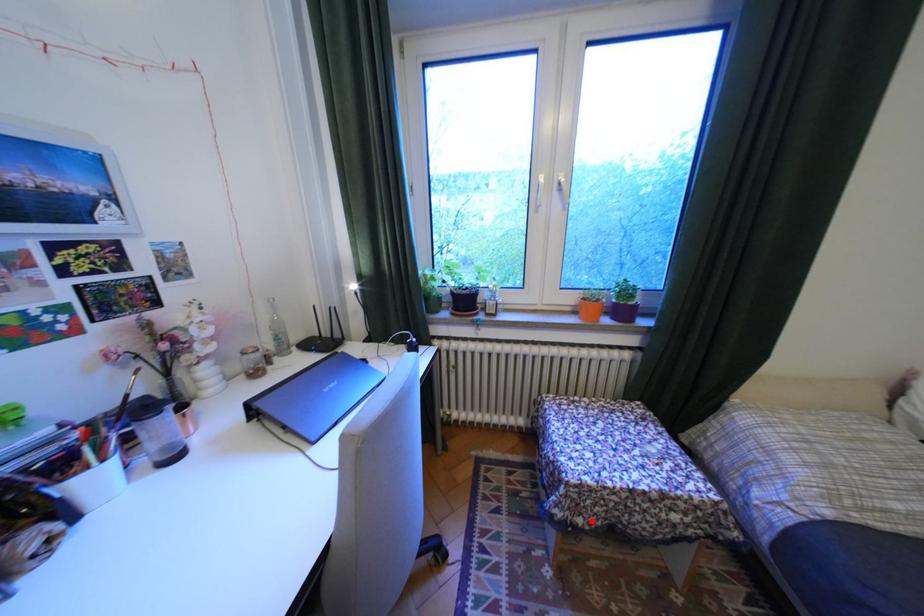
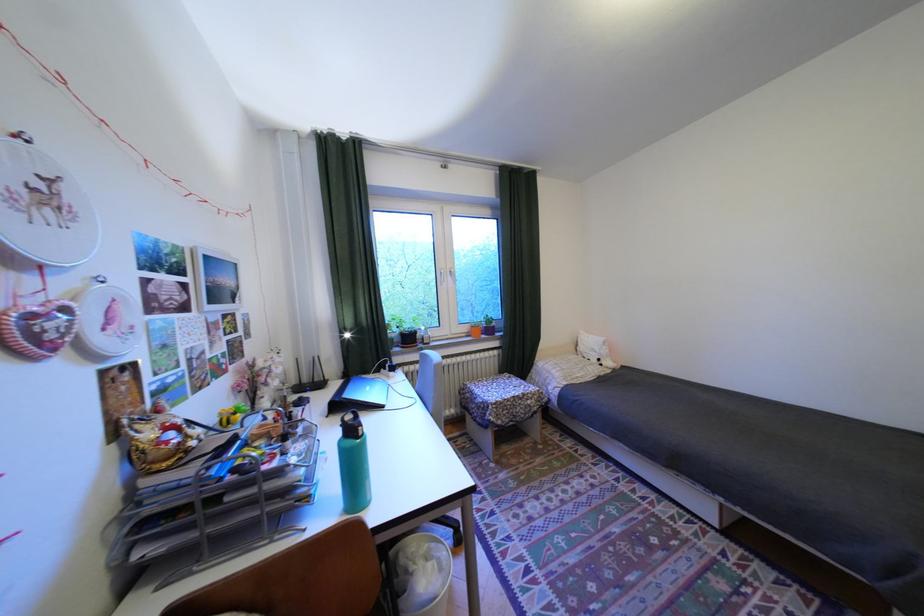
Question: I am providing you with two images of the same scene from different viewpoints. A red point is marked on the first image. At the location where the point appears in image 1, is it still visible in image 2?

Choices:
 (A) Yes
 (B) No

Answer: (A)